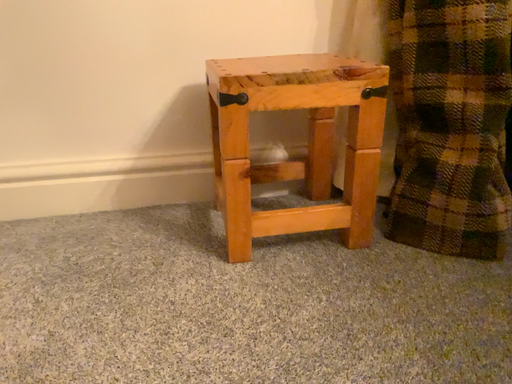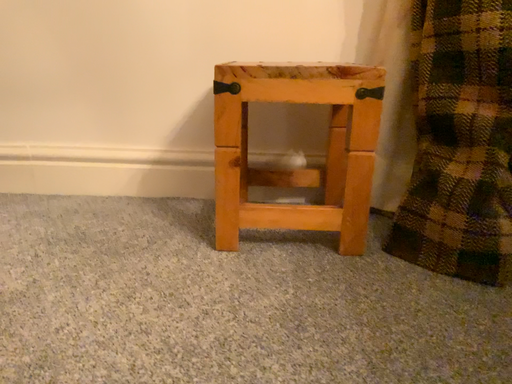
Question: How did the camera likely rotate when shooting the video?

Choices:
 (A) rotated left
 (B) rotated right

Answer: (A)